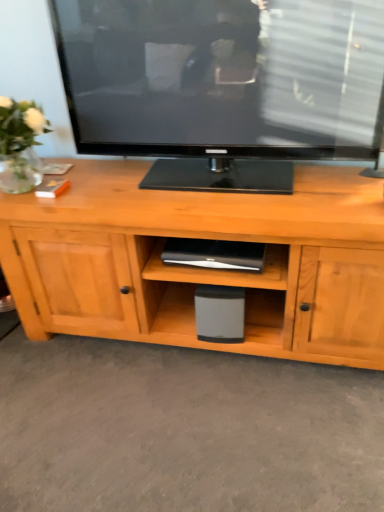
Question: Is clear glass vase at left wider or thinner than gray matte speaker at center?

Choices:
 (A) wide
 (B) thin

Answer: (A)

Question: Is point (6, 141) positioned closer to the camera than point (233, 302)?

Choices:
 (A) closer
 (B) farther

Answer: (A)

Question: Is clear glass vase at left inside the boundaries of gray matte speaker at center, or outside?

Choices:
 (A) outside
 (B) inside

Answer: (A)

Question: Considering the positions of gray matte speaker at center and clear glass vase at left in the image, is gray matte speaker at center wider or thinner than clear glass vase at left?

Choices:
 (A) wide
 (B) thin

Answer: (B)

Question: From a real-world perspective, is gray matte speaker at center above or below clear glass vase at left?

Choices:
 (A) below
 (B) above

Answer: (A)

Question: Would you say gray matte speaker at center is to the left or to the right of clear glass vase at left in the picture?

Choices:
 (A) right
 (B) left

Answer: (A)

Question: From the image's perspective, is gray matte speaker at center above or below clear glass vase at left?

Choices:
 (A) below
 (B) above

Answer: (A)